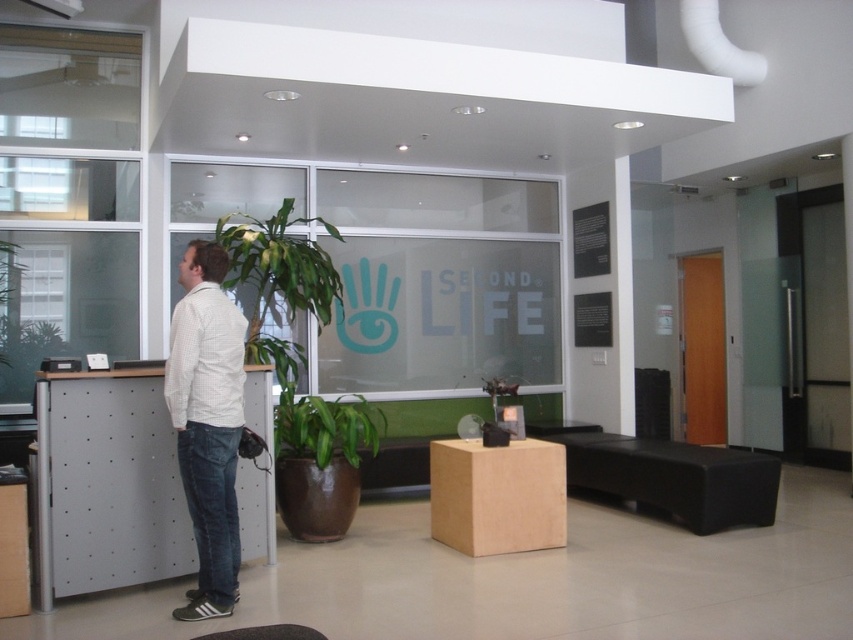
Question: Which point is farther to the camera?

Choices:
 (A) (207, 344)
 (B) (346, 410)
 (C) (219, 634)

Answer: (B)

Question: Is green glossy plant at center positioned before black leather stool at lower center?

Choices:
 (A) no
 (B) yes

Answer: (A)

Question: Can you confirm if white checkered shirt at left is positioned to the right of green glossy plant at center?

Choices:
 (A) no
 (B) yes

Answer: (A)

Question: Among these points, which one is nearest to the camera?

Choices:
 (A) (213, 632)
 (B) (280, 392)
 (C) (228, 301)

Answer: (A)

Question: Which object appears closest to the camera in this image?

Choices:
 (A) green glossy plant at center
 (B) black leather stool at lower center
 (C) white checkered shirt at left

Answer: (B)

Question: Is white checkered shirt at left to the left of green glossy plant at center from the viewer's perspective?

Choices:
 (A) yes
 (B) no

Answer: (A)